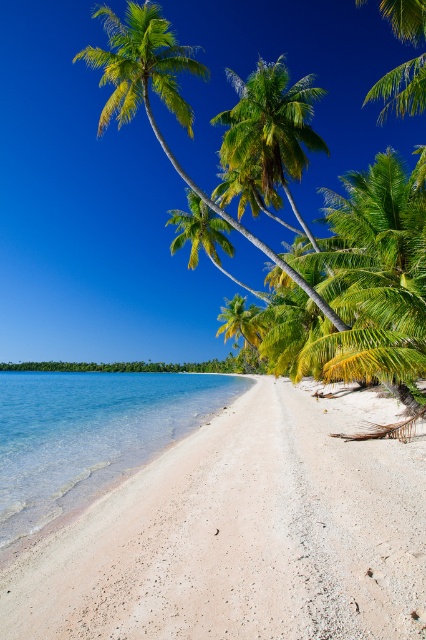
Question: Which of these objects is positioned closest to the clear water at lower left?

Choices:
 (A) white sandy beach at center
 (B) green leafy palm tree at upper left

Answer: (A)

Question: Is white sandy beach at center bigger than clear water at lower left?

Choices:
 (A) yes
 (B) no

Answer: (B)

Question: Is clear water at lower left to the left of green leafy palm tree at upper left from the viewer's perspective?

Choices:
 (A) yes
 (B) no

Answer: (A)

Question: Which point is farther from the camera taking this photo?

Choices:
 (A) (347, 396)
 (B) (135, 77)

Answer: (A)

Question: Can you confirm if clear water at lower left is thinner than green leafy palm tree at center?

Choices:
 (A) no
 (B) yes

Answer: (A)

Question: Estimate the real-world distances between objects in this image. Which object is closer to the clear water at lower left?

Choices:
 (A) white sandy beach at center
 (B) green leafy palm tree at center
 (C) green leafy palm tree at upper left

Answer: (A)